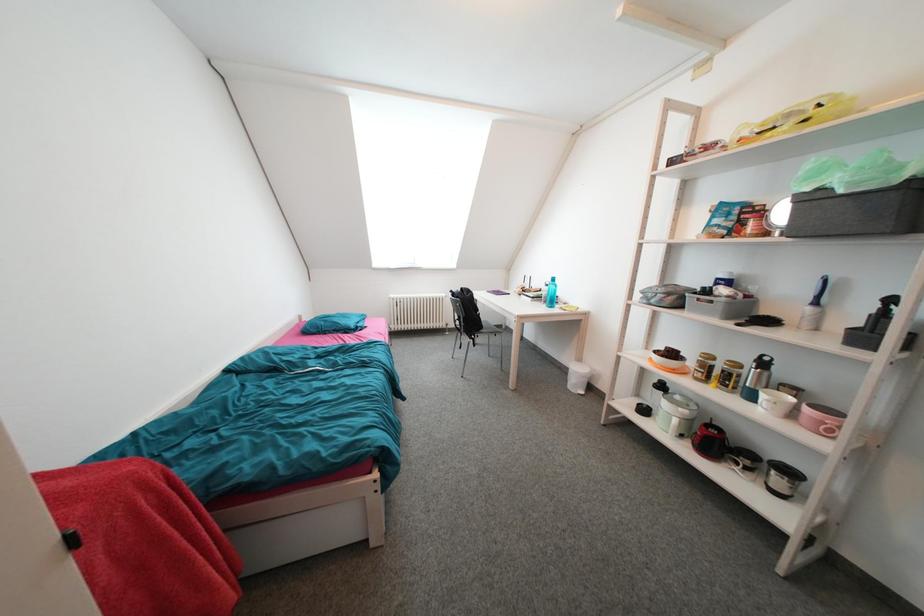
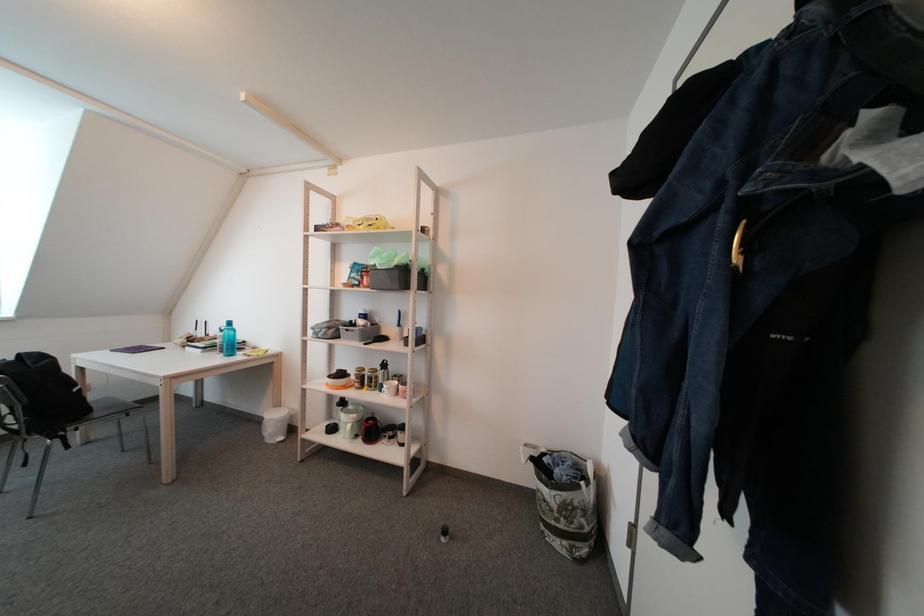
Question: The camera is either moving clockwise (left) or counter-clockwise (right) around the object. The first image is from the beginning of the video and the second image is from the end. Is the camera moving left or right when shooting the video?

Choices:
 (A) Left
 (B) Right

Answer: (A)